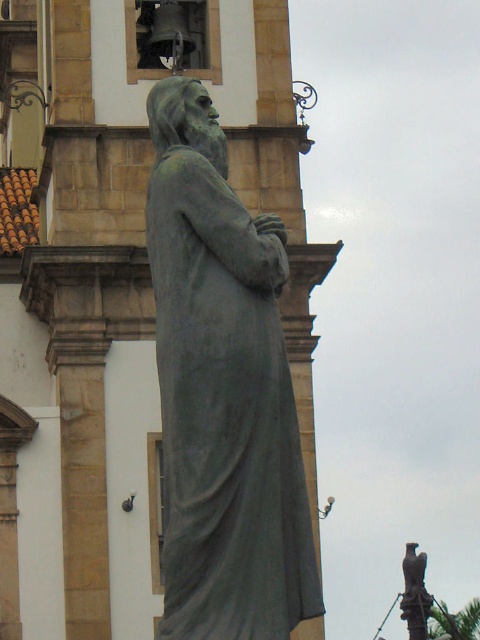
Question: Observing the image, what is the correct spatial positioning of green patina statue at center in reference to bronze statue at lower right?

Choices:
 (A) above
 (B) below

Answer: (A)

Question: Can you confirm if green patina statue at center is thinner than bronze statue at lower right?

Choices:
 (A) yes
 (B) no

Answer: (A)

Question: Among these objects, which one is nearest to the camera?

Choices:
 (A) bronze statue at lower right
 (B) green patina statue at center

Answer: (B)

Question: Which point is farther from the camera taking this photo?

Choices:
 (A) (408, 604)
 (B) (236, 605)

Answer: (A)

Question: Is green patina statue at center below bronze statue at lower right?

Choices:
 (A) yes
 (B) no

Answer: (B)